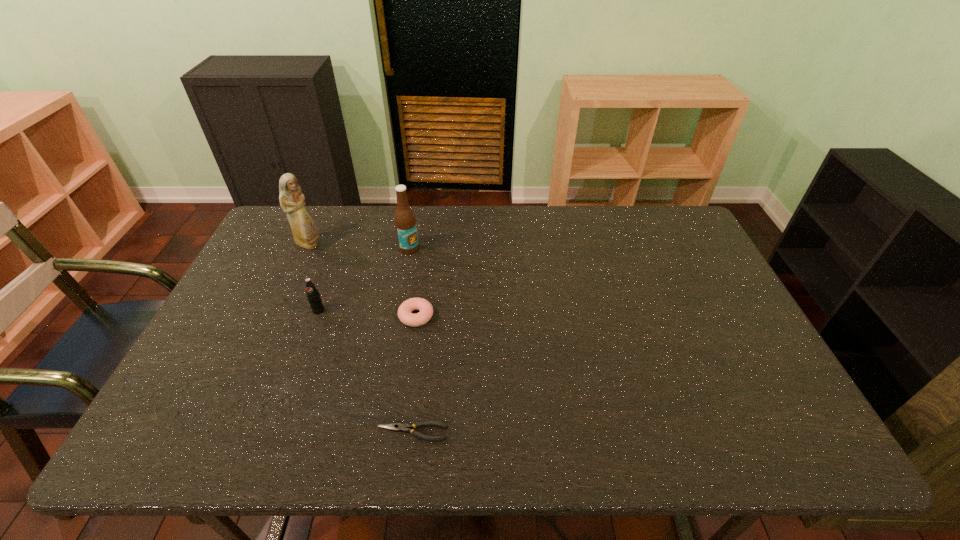
Identify the location of free spot that satisfies the following two spatial constraints: 1. on the back side of the shortest object; 2. on the front-facing side of the figurine. The width and height of the screenshot is (960, 540). (434, 245).